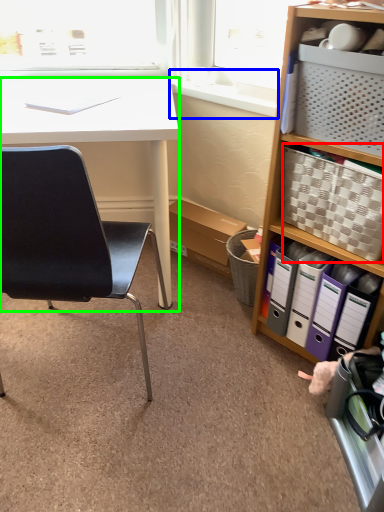
Question: Which is farther away from picnic basket (highlighted by a red box)? window sill (highlighted by a blue box) or desk (highlighted by a green box)?

Choices:
 (A) window sill
 (B) desk

Answer: (B)